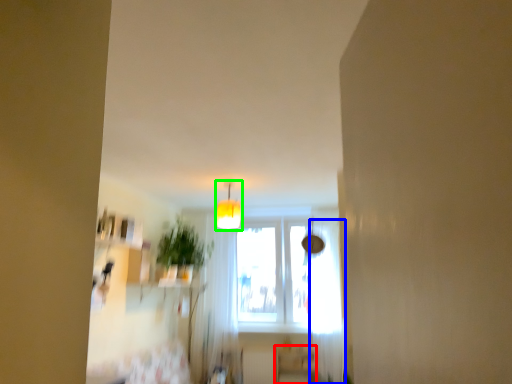
Question: Considering the real-world distances, which object is farthest from furniture (highlighted by a red box)? curtain (highlighted by a blue box) or light fixture (highlighted by a green box)?

Choices:
 (A) curtain
 (B) light fixture

Answer: (B)